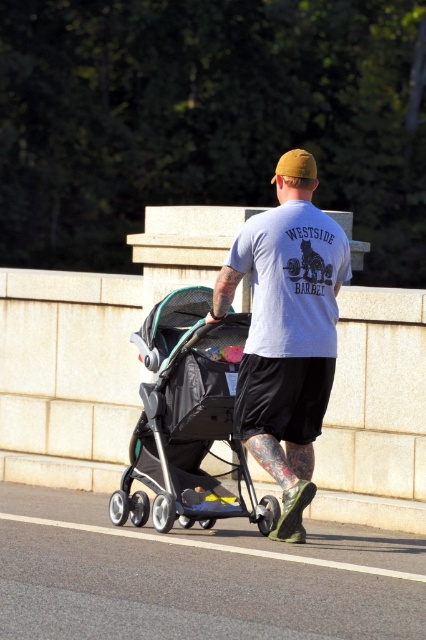
Is gray cotton t-shirt at center to the right of matte yellow baseball cap at upper center from the viewer's perspective?

In fact, gray cotton t-shirt at center is to the left of matte yellow baseball cap at upper center.

Which is in front, point (322, 380) or point (291, 150)?

Positioned in front is point (322, 380).

Locate an element on the screen. This screenshot has width=426, height=640. gray cotton t-shirt at center is located at coordinates point(285,337).

Between gray cotton t-shirt at center and black textured stroller at center, which one has more height?

gray cotton t-shirt at center is taller.

Who is more forward, (x=236, y=259) or (x=201, y=387)?

Point (x=236, y=259)

I want to click on gray cotton t-shirt at center, so click(x=285, y=337).

Is black textured stroller at center taller than matte yellow baseball cap at upper center?

No.

Does black textured stroller at center have a smaller size compared to matte yellow baseball cap at upper center?

Yes.

Which is in front, point (173, 300) or point (273, 180)?

Point (173, 300)

At what (x,y) coordinates should I click in order to perform the action: click on black textured stroller at center. Please return your answer as a coordinate pair (x, y). This screenshot has height=640, width=426. Looking at the image, I should click on (187, 419).